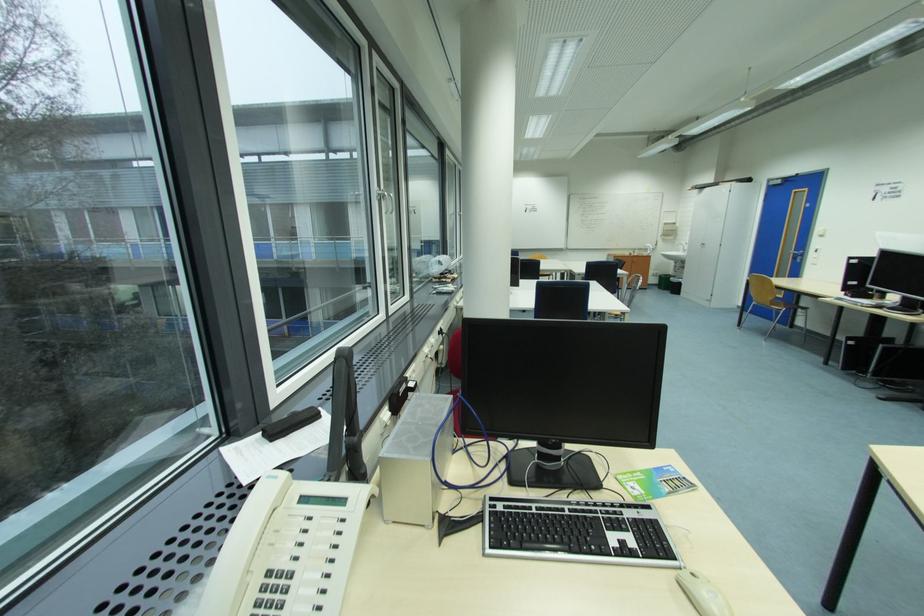
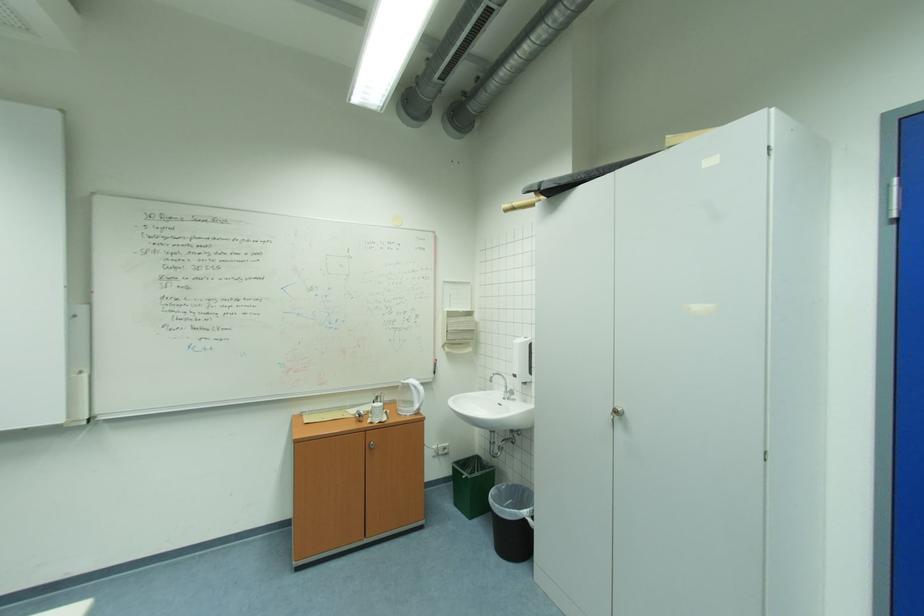
The point at (709, 188) is marked in the first image. Where is the corresponding point in the second image?

(569, 182)